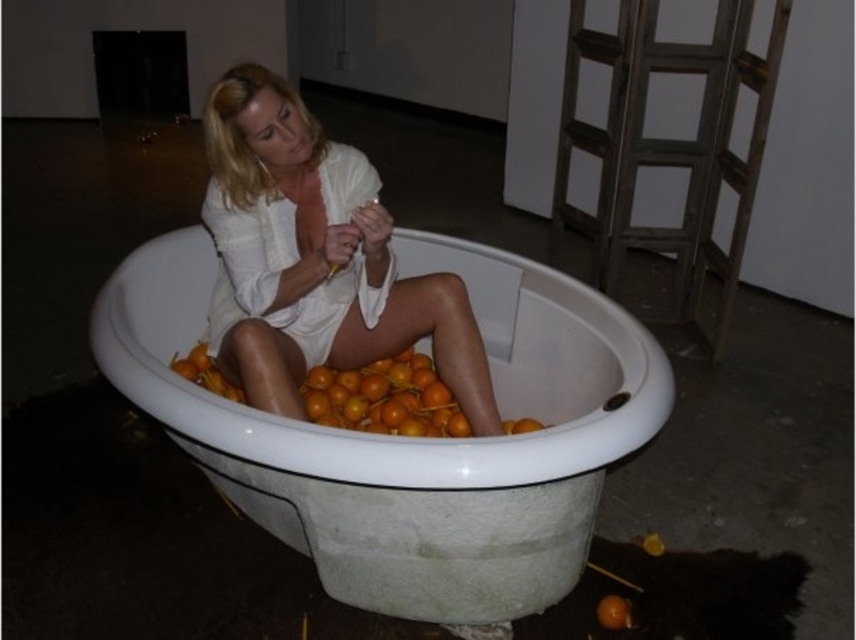
Question: Can you confirm if white glossy tub at center is smaller than orange matte/orange at center?

Choices:
 (A) yes
 (B) no

Answer: (B)

Question: Considering the real-world distances, which object is closest to the orange matte/orange at center?

Choices:
 (A) white matte dress at center
 (B) wooden ladder at right
 (C) white glossy tub at center

Answer: (A)

Question: Is white glossy tub at center positioned before wooden ladder at right?

Choices:
 (A) yes
 (B) no

Answer: (A)

Question: Which point appears farthest from the camera in this image?

Choices:
 (A) (388, 362)
 (B) (742, 10)
 (C) (242, 493)

Answer: (B)

Question: Is white matte dress at center below wooden ladder at right?

Choices:
 (A) no
 (B) yes

Answer: (B)

Question: Which point is farther to the camera?

Choices:
 (A) wooden ladder at right
 (B) white matte dress at center
 (C) white glossy tub at center
 (D) orange matte/orange at center

Answer: (A)